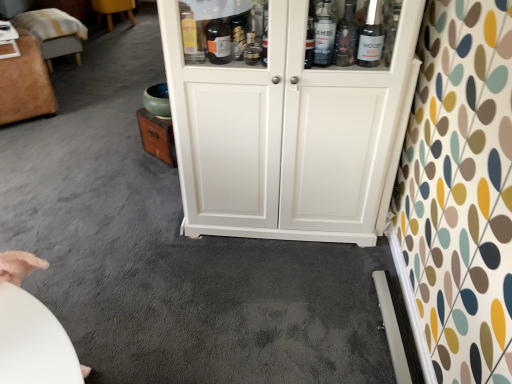
Measure the distance between white wood cupboard at center and camera.

The distance of white wood cupboard at center from camera is 4.53 feet.

Find the location of a particular element. This screenshot has height=384, width=512. white glossy table at upper left is located at coordinates (8, 41).

Consider the image. Is velvet ottoman at left, which is the third furniture from back to front, located within wooden stool at upper left, the third furniture positioned from the front?

Definitely not — velvet ottoman at left, which is the third furniture from back to front, is not inside wooden stool at upper left, the third furniture positioned from the front.

What's the angular difference between wooden stool at upper left, which ranks as the first furniture in back-to-front order, and velvet ottoman at left, which is the third furniture from back to front,'s facing directions?

They differ by 86.9 degrees in their facing directions.

Is wooden stool at upper left, which ranks as the first furniture in back-to-front order, not near velvet ottoman at left, marked as the 1th furniture in a front-to-back arrangement?

Yes, wooden stool at upper left, which ranks as the first furniture in back-to-front order, and velvet ottoman at left, marked as the 1th furniture in a front-to-back arrangement, are quite far apart.

Is wooden stool at upper left, the third furniture positioned from the front, shorter than velvet ottoman at left, marked as the 1th furniture in a front-to-back arrangement?

Correct, wooden stool at upper left, the third furniture positioned from the front, is not as tall as velvet ottoman at left, marked as the 1th furniture in a front-to-back arrangement.

Is wooden stool at upper left, the third furniture positioned from the front, surrounded by white glossy table at upper left?

No, wooden stool at upper left, the third furniture positioned from the front, is not surrounded by white glossy table at upper left.

Looking at this image, from a real-world perspective, between white glossy table at upper left and wooden stool at upper left, the third furniture positioned from the front, who is vertically lower?

wooden stool at upper left, the third furniture positioned from the front.

Is velvet ottoman at upper left, which is the second furniture in front-to-back order, looking in the opposite direction of white wood cupboard at center?

That's not correct — velvet ottoman at upper left, which is the second furniture in front-to-back order, is not looking away from white wood cupboard at center.

Is velvet ottoman at upper left, which is the 2th furniture in back-to-front order, located outside white wood cupboard at center?

Absolutely, velvet ottoman at upper left, which is the 2th furniture in back-to-front order, is external to white wood cupboard at center.

Is velvet ottoman at upper left, which is the second furniture in front-to-back order, not near white wood cupboard at center?

Yes, velvet ottoman at upper left, which is the second furniture in front-to-back order, and white wood cupboard at center are quite far apart.

Which of these two, velvet ottoman at upper left, which is the 2th furniture in back-to-front order, or white wood cupboard at center, is thinner?

white wood cupboard at center is thinner.

From the picture: Is velvet ottoman at upper left, which is the 2th furniture in back-to-front order, inside or outside of white glossy table at upper left?

The correct answer is: outside.

In the image, is velvet ottoman at upper left, which is the 2th furniture in back-to-front order, positioned in front of or behind white glossy table at upper left?

velvet ottoman at upper left, which is the 2th furniture in back-to-front order, is positioned farther from the viewer than white glossy table at upper left.

Looking at the image, does velvet ottoman at upper left, which is the 2th furniture in back-to-front order, seem bigger or smaller compared to white glossy table at upper left?

velvet ottoman at upper left, which is the 2th furniture in back-to-front order, is bigger than white glossy table at upper left.

Between velvet ottoman at upper left, which is the second furniture in front-to-back order, and white glossy table at upper left, which one appears on the right side from the viewer's perspective?

white glossy table at upper left is more to the right.

Looking at the image, does wooden stool at upper left, which ranks as the first furniture in back-to-front order, seem bigger or smaller compared to velvet ottoman at upper left, which is the second furniture in front-to-back order?

Clearly, wooden stool at upper left, which ranks as the first furniture in back-to-front order, is smaller in size than velvet ottoman at upper left, which is the second furniture in front-to-back order.

From the image's perspective, is wooden stool at upper left, which ranks as the first furniture in back-to-front order, located beneath velvet ottoman at upper left, which is the 2th furniture in back-to-front order?

Actually, wooden stool at upper left, which ranks as the first furniture in back-to-front order, appears above velvet ottoman at upper left, which is the 2th furniture in back-to-front order, in the image.

Which object is positioned more to the right, wooden stool at upper left, which ranks as the first furniture in back-to-front order, or velvet ottoman at upper left, which is the second furniture in front-to-back order?

From the viewer's perspective, wooden stool at upper left, which ranks as the first furniture in back-to-front order, appears more on the right side.

Is wooden stool at upper left, which ranks as the first furniture in back-to-front order, aimed at velvet ottoman at upper left, which is the second furniture in front-to-back order?

No, wooden stool at upper left, which ranks as the first furniture in back-to-front order, is not turned towards velvet ottoman at upper left, which is the second furniture in front-to-back order.

Is white wood cupboard at center surrounded by wooden stool at upper left, the third furniture positioned from the front?

No, white wood cupboard at center is not inside wooden stool at upper left, the third furniture positioned from the front.

Is wooden stool at upper left, which ranks as the first furniture in back-to-front order, oriented towards white wood cupboard at center?

Yes, wooden stool at upper left, which ranks as the first furniture in back-to-front order, is facing white wood cupboard at center.

How many degrees apart are the facing directions of wooden stool at upper left, the third furniture positioned from the front, and white wood cupboard at center?

The facing directions of wooden stool at upper left, the third furniture positioned from the front, and white wood cupboard at center are 45.7 degrees apart.

You are a GUI agent. You are given a task and a screenshot of the screen. Output one action in this format:
    pyautogui.click(x=<x>, y=<y>)
    Task: Click on the cupboard that appears above the wooden stool at upper left, which ranks as the first furniture in back-to-front order (from a real-world perspective)
    The width and height of the screenshot is (512, 384).
    Given the screenshot: What is the action you would take?
    pyautogui.click(x=285, y=127)

Looking at their sizes, would you say wooden stool at upper left, the third furniture positioned from the front, is wider or thinner than white glossy table at upper left?

wooden stool at upper left, the third furniture positioned from the front, is wider than white glossy table at upper left.

From the image's perspective, is wooden stool at upper left, which ranks as the first furniture in back-to-front order, located above white glossy table at upper left?

Yes, from the image's perspective, wooden stool at upper left, which ranks as the first furniture in back-to-front order, is over white glossy table at upper left.

Who is taller, wooden stool at upper left, the third furniture positioned from the front, or white glossy table at upper left?

wooden stool at upper left, the third furniture positioned from the front.

Is white glossy table at upper left completely or partially inside wooden stool at upper left, which ranks as the first furniture in back-to-front order?

A: No, white glossy table at upper left is not inside wooden stool at upper left, which ranks as the first furniture in back-to-front order.

From the velvet ottoman at left, marked as the 1th furniture in a front-to-back arrangement, count 2nd furnitures backward and point to it. Please provide its 2D coordinates.

[(114, 10)]

From a real-world perspective, starting from the white glossy table at upper left, which furniture is the 3rd one below it? Please provide its 2D coordinates.

[(114, 10)]

When comparing their distances from white glossy table at upper left, does velvet ottoman at left, which is the third furniture from back to front, or wooden stool at upper left, which ranks as the first furniture in back-to-front order, seem further?

wooden stool at upper left, which ranks as the first furniture in back-to-front order, is further to white glossy table at upper left.

When comparing their distances from white glossy table at upper left, does wooden stool at upper left, the third furniture positioned from the front, or velvet ottoman at left, marked as the 1th furniture in a front-to-back arrangement, seem further?

Among the two, wooden stool at upper left, the third furniture positioned from the front, is located further to white glossy table at upper left.

Which object lies nearer to the anchor point velvet ottoman at left, marked as the 1th furniture in a front-to-back arrangement, velvet ottoman at upper left, which is the 2th furniture in back-to-front order, or wooden stool at upper left, the third furniture positioned from the front?

velvet ottoman at upper left, which is the 2th furniture in back-to-front order, is closer to velvet ottoman at left, marked as the 1th furniture in a front-to-back arrangement.

From the image, which object appears to be farther from velvet ottoman at upper left, which is the second furniture in front-to-back order, velvet ottoman at left, which is the third furniture from back to front, or white wood cupboard at center?

white wood cupboard at center is positioned further to the anchor velvet ottoman at upper left, which is the second furniture in front-to-back order.

Considering their positions, is velvet ottoman at left, which is the third furniture from back to front, positioned closer to white glossy table at upper left than velvet ottoman at upper left, which is the second furniture in front-to-back order?

velvet ottoman at left, which is the third furniture from back to front, is closer to white glossy table at upper left.

From the image, which object appears to be nearer to wooden stool at upper left, the third furniture positioned from the front, velvet ottoman at upper left, which is the second furniture in front-to-back order, or white glossy table at upper left?

velvet ottoman at upper left, which is the second furniture in front-to-back order.

Based on their spatial positions, is velvet ottoman at upper left, which is the second furniture in front-to-back order, or white wood cupboard at center further from velvet ottoman at left, marked as the 1th furniture in a front-to-back arrangement?

white wood cupboard at center.

From the image, which object appears to be nearer to velvet ottoman at upper left, which is the 2th furniture in back-to-front order, white wood cupboard at center or white glossy table at upper left?

Among the two, white glossy table at upper left is located nearer to velvet ottoman at upper left, which is the 2th furniture in back-to-front order.

The image size is (512, 384). Find the location of `furniture between velvet ottoman at left, which is the third furniture from back to front, and wooden stool at upper left, the third furniture positioned from the front, from front to back`. furniture between velvet ottoman at left, which is the third furniture from back to front, and wooden stool at upper left, the third furniture positioned from the front, from front to back is located at coordinates (54, 33).

Identify the location of table between velvet ottoman at left, marked as the 1th furniture in a front-to-back arrangement, and white wood cupboard at center, in the horizontal direction. The width and height of the screenshot is (512, 384). (8, 41).

Locate an element on the screen. The height and width of the screenshot is (384, 512). furniture located between white glossy table at upper left and wooden stool at upper left, which ranks as the first furniture in back-to-front order, in the depth direction is located at coordinates (54, 33).

Identify the location of table located between white wood cupboard at center and wooden stool at upper left, which ranks as the first furniture in back-to-front order, in the depth direction. Image resolution: width=512 pixels, height=384 pixels. (8, 41).